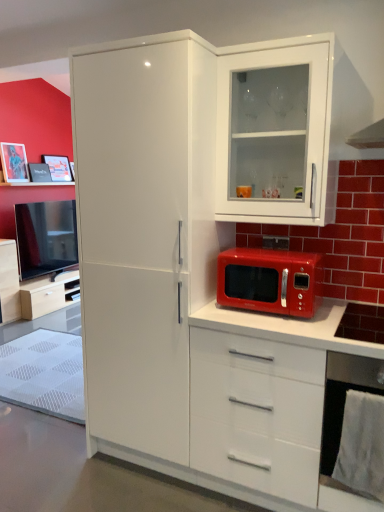
Question: Considering the relative sizes of matte white cabinet at left, which ranks as the 1th cabinetry in back-to-front order, and shiny red microwave at center in the image provided, is matte white cabinet at left, which ranks as the 1th cabinetry in back-to-front order, thinner than shiny red microwave at center?

Choices:
 (A) no
 (B) yes

Answer: (B)

Question: Is matte white cabinet at left, marked as the 1th cabinetry in a bottom-to-top arrangement, not within shiny red microwave at center?

Choices:
 (A) yes
 (B) no

Answer: (A)

Question: Does matte white cabinet at left, marked as the 2th cabinetry in a front-to-back arrangement, have a lesser height compared to shiny red microwave at center?

Choices:
 (A) yes
 (B) no

Answer: (B)

Question: Could you tell me if matte white cabinet at left, acting as the second cabinetry starting from the top, is facing shiny red microwave at center?

Choices:
 (A) yes
 (B) no

Answer: (B)

Question: Is matte white cabinet at left, the 1th cabinetry positioned from the left, turned away from shiny red microwave at center?

Choices:
 (A) yes
 (B) no

Answer: (B)

Question: Is point (67, 162) closer or farther from the camera than point (3, 275)?

Choices:
 (A) farther
 (B) closer

Answer: (A)

Question: Based on their positions, is matte black picture frame at upper left, placed as the 1th picture frame when sorted from right to left, located to the left or right of matte white cabinet at left, marked as the 1th cabinetry in a bottom-to-top arrangement?

Choices:
 (A) left
 (B) right

Answer: (B)

Question: From a real-world perspective, relative to matte white cabinet at left, marked as the 1th cabinetry in a bottom-to-top arrangement, is matte black picture frame at upper left, placed as the 1th picture frame when sorted from right to left, vertically above or below?

Choices:
 (A) below
 (B) above

Answer: (B)

Question: Is matte black picture frame at upper left, which ranks as the second picture frame in left-to-right order, wider or thinner than matte white cabinet at left, which is counted as the 2th cabinetry, starting from the right?

Choices:
 (A) wide
 (B) thin

Answer: (B)

Question: In terms of width, does white glossy cabinet at upper right, arranged as the first cabinetry when viewed from the front, look wider or thinner when compared to brushed metal picture frame at upper left, which is the second picture frame from back to front?

Choices:
 (A) wide
 (B) thin

Answer: (A)

Question: In the image, is white glossy cabinet at upper right, which is the 1th cabinetry from right to left, positioned in front of or behind brushed metal picture frame at upper left, the 2th picture frame when ordered from right to left?

Choices:
 (A) behind
 (B) front

Answer: (B)

Question: Is white glossy cabinet at upper right, the second cabinetry when ordered from back to front, to the left or to the right of brushed metal picture frame at upper left, which is the first picture frame in front-to-back order, in the image?

Choices:
 (A) right
 (B) left

Answer: (A)

Question: Is white glossy cabinet at upper right, which is the 1th cabinetry from right to left, taller or shorter than brushed metal picture frame at upper left, the 2th picture frame when ordered from right to left?

Choices:
 (A) tall
 (B) short

Answer: (A)

Question: From a real-world perspective, relative to matte black phone at center, is white glossy cabinet at upper right, arranged as the first cabinetry when viewed from the front, vertically above or below?

Choices:
 (A) below
 (B) above

Answer: (B)

Question: Considering the positions of white glossy cabinet at upper right, which is the 1th cabinetry from right to left, and matte black phone at center in the image, is white glossy cabinet at upper right, which is the 1th cabinetry from right to left, wider or thinner than matte black phone at center?

Choices:
 (A) thin
 (B) wide

Answer: (B)